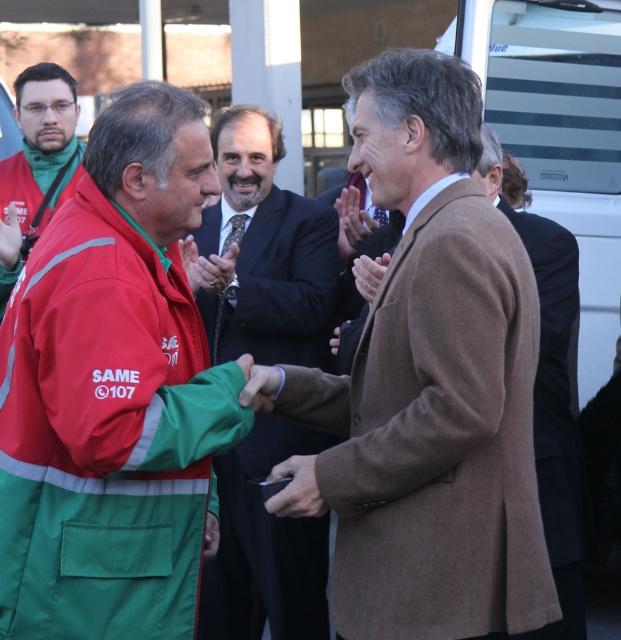
You are standing at the position of the viewer in the image. There is a green fabric jacket at center. Do you think you can reach it without moving from your current position?

The green fabric jacket at center and viewer are 4.54 meters apart, so you cannot reach it without moving from your current position.

You are standing in the outdoor ceremony and want to take a photo of both the green fabric jacket at center and the brown wool coat at center. Which one should you focus on first to ensure it appears sharp in the photo?

You should focus on the green fabric jacket at center first because it is closer to you than the brown wool coat at center, ensuring it will be in focus.

From the picture: You are an event organizer who needs to arrange seating for two guests wearing the brown woolen coat at center and the green fabric jacket at center. Which guest should you seat in a larger chair to accommodate their coat?

The brown woolen coat at center has a larger size compared to the green fabric jacket at center, so you should seat the guest wearing the brown woolen coat at center in a larger chair to accommodate their coat.